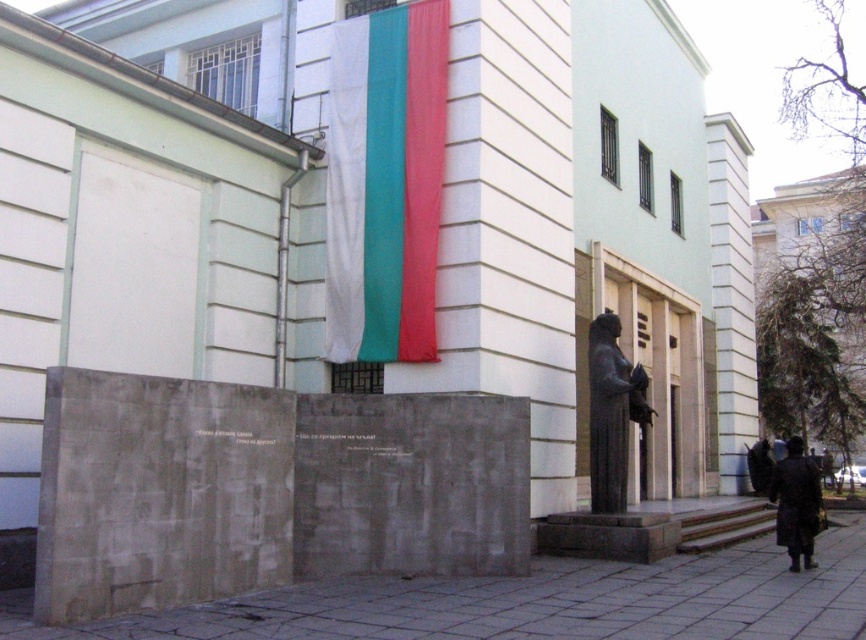
Question: Which of the following is the farthest from the observer?

Choices:
 (A) black polished statue at right
 (B) dark brown leather coat at lower right

Answer: (A)

Question: Does gray concrete pavement at lower center have a smaller size compared to dark brown leather coat at lower right?

Choices:
 (A) no
 (B) yes

Answer: (B)

Question: Is black polished statue at right above dark brown leather coat at lower right?

Choices:
 (A) no
 (B) yes

Answer: (B)

Question: Estimate the real-world distances between objects in this image. Which object is farther from the dark brown leather coat at lower right?

Choices:
 (A) black polished statue at right
 (B) gray concrete pavement at lower center

Answer: (B)

Question: Which point is closer to the camera?

Choices:
 (A) (624, 492)
 (B) (780, 467)

Answer: (B)

Question: From the image, what is the correct spatial relationship of black polished statue at right in relation to dark brown leather coat at lower right?

Choices:
 (A) left
 (B) right

Answer: (A)